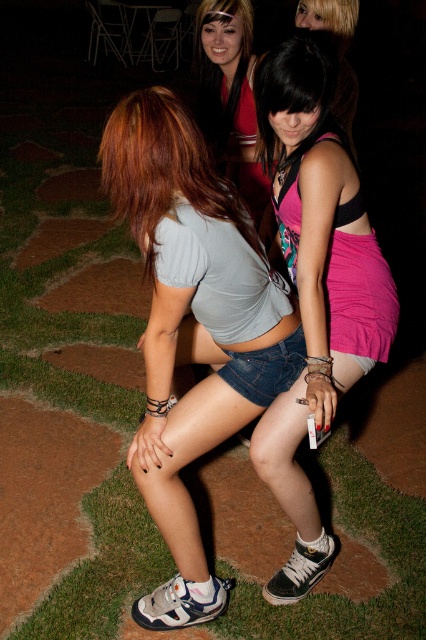
How much distance is there between matte gray shirt at center and pink matte tank top at center?

matte gray shirt at center and pink matte tank top at center are 10.28 inches apart.

Can you confirm if matte gray shirt at center is thinner than pink matte tank top at center?

In fact, matte gray shirt at center might be wider than pink matte tank top at center.

The image size is (426, 640). I want to click on matte gray shirt at center, so click(192, 326).

Between matte gray shirt at center and matte red dress at upper center, which one has less height?

Standing shorter between the two is matte red dress at upper center.

Does matte gray shirt at center have a greater height compared to matte red dress at upper center?

Yes.

Between point (157, 100) and point (227, 17), which one is positioned in front?

Point (157, 100) is in front.

Where is `matte gray shirt at center`? matte gray shirt at center is located at coordinates (192, 326).

Who is higher up, pink matte tank top at center or matte red dress at upper center?

Positioned higher is matte red dress at upper center.

Can you confirm if pink matte tank top at center is shorter than matte red dress at upper center?

No.

Describe the element at coordinates (316, 282) in the screenshot. The height and width of the screenshot is (640, 426). I see `pink matte tank top at center` at that location.

You are a GUI agent. You are given a task and a screenshot of the screen. Output one action in this format:
    pyautogui.click(x=<x>, y=<y>)
    Task: Click on the pink matte tank top at center
    The width and height of the screenshot is (426, 640).
    Given the screenshot: What is the action you would take?
    pyautogui.click(x=316, y=282)